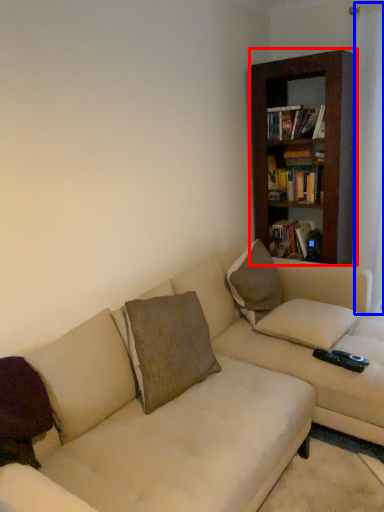
Question: Among these objects, which one is nearest to the camera, bookcase (highlighted by a red box) or curtain (highlighted by a blue box)?

Choices:
 (A) bookcase
 (B) curtain

Answer: (B)